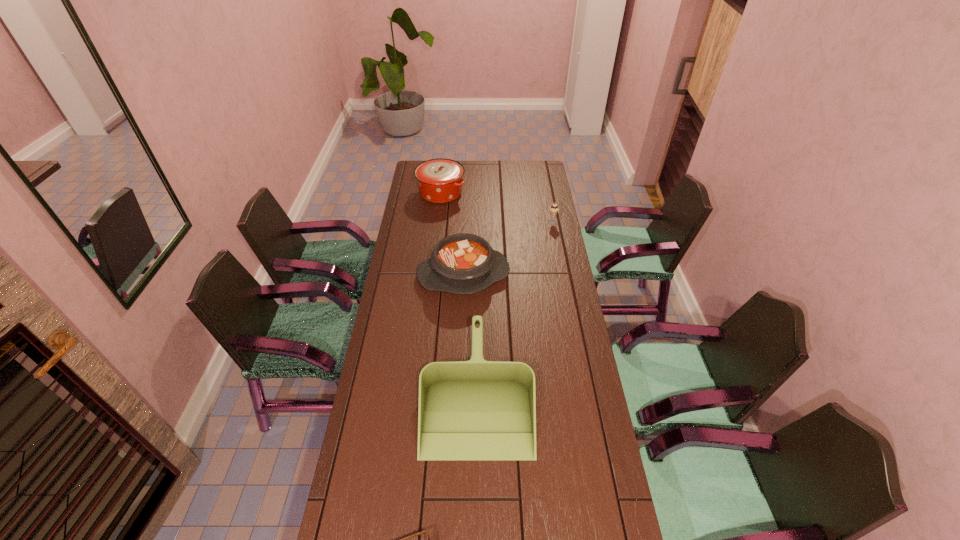
Locate an element on the screen. vacant space in between the tallest object and the second farthest object is located at coordinates (496, 207).

Select which object appears as the fourth closest to the rightmost object. Please provide its 2D coordinates. Your answer should be formatted as a tuple, i.e. [(x, y)], where the tuple contains the x and y coordinates of a point satisfying the conditions above.

[(428, 538)]

Find the location of a particular element. This screenshot has width=960, height=540. the closest object to the sunglasses is located at coordinates (468, 410).

The image size is (960, 540). Find the location of `vacant point that satisfies the following two spatial constraints: 1. on the front side of the farther casserole; 2. on the right side of the third farthest object`. vacant point that satisfies the following two spatial constraints: 1. on the front side of the farther casserole; 2. on the right side of the third farthest object is located at coordinates (432, 274).

Locate an element on the screen. free location that satisfies the following two spatial constraints: 1. on the back side of the fourth nearest object; 2. on the left side of the shorter casserole is located at coordinates (466, 221).